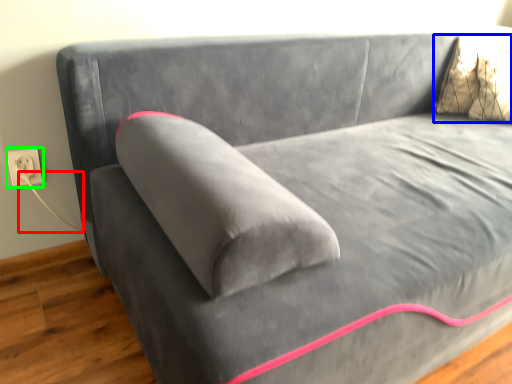
Question: Estimate the real-world distances between objects in this image. Which object is closer to string (highlighted by a red box), pillow (highlighted by a blue box) or electric outlet (highlighted by a green box)?

Choices:
 (A) pillow
 (B) electric outlet

Answer: (B)